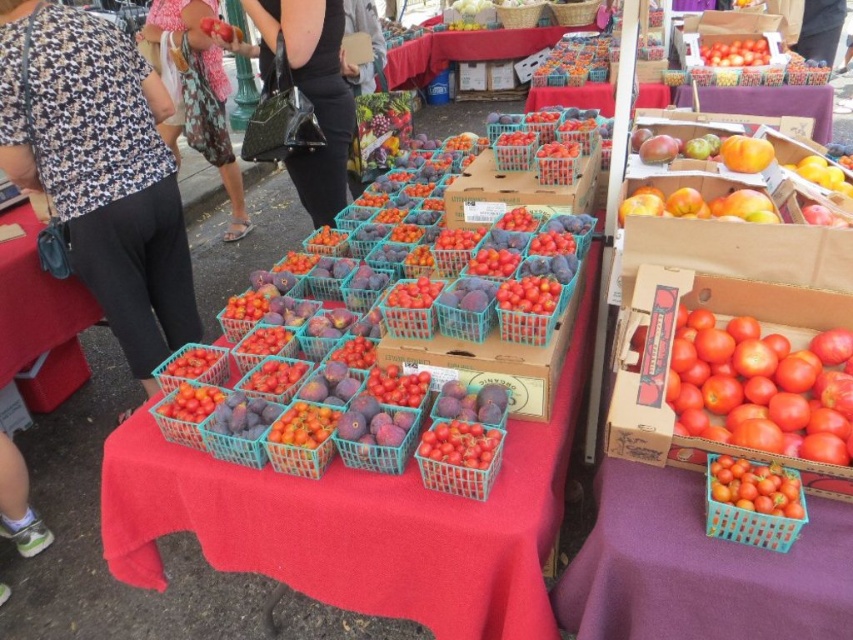
Between glossy red tomato at center right and floral fabric dress at upper left, which one is positioned lower?

glossy red tomato at center right is below.

Is glossy red tomato at center right wider than floral fabric dress at upper left?

Incorrect, glossy red tomato at center right's width does not surpass floral fabric dress at upper left's.

Is point (701, 355) less distant than point (207, 100)?

Yes, it is.

Where is `glossy red tomato at center right`? Image resolution: width=853 pixels, height=640 pixels. glossy red tomato at center right is located at coordinates (762, 387).

Who is shorter, floral-patterned shirt at left or translucent plastic basket at center?

translucent plastic basket at center

Identify the location of floral-patterned shirt at left. (100, 170).

Is point (32, 129) behind point (759, 508)?

Yes.

At what (x,y) coordinates should I click in order to perform the action: click on floral-patterned shirt at left. Please return your answer as a coordinate pair (x, y). Looking at the image, I should click on (100, 170).

Where is `black leather handbag at upper center`? Image resolution: width=853 pixels, height=640 pixels. black leather handbag at upper center is located at coordinates (312, 93).

Between black leather handbag at upper center and translucent plastic basket at center, which one has more height?

black leather handbag at upper center is taller.

Who is more distant from viewer, (321, 93) or (727, 536)?

The point (321, 93) is behind.

Where is `black leather handbag at upper center`? black leather handbag at upper center is located at coordinates (312, 93).